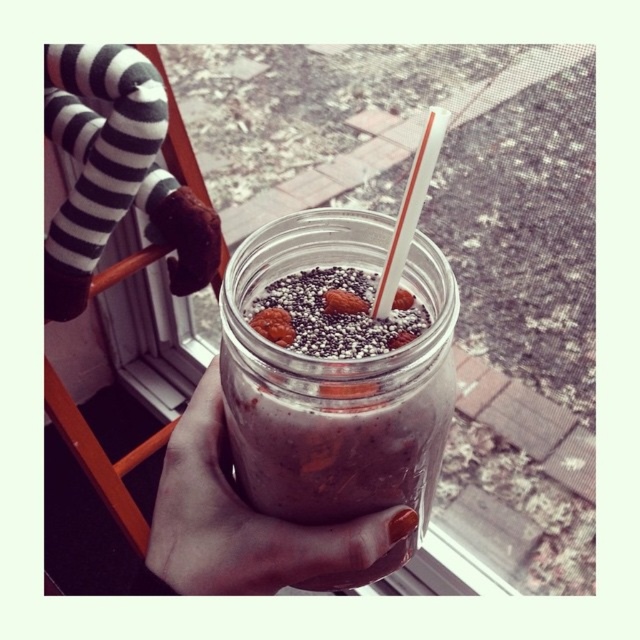
Is translucent glass jar at center to the left of matte glass jar at center from the viewer's perspective?

Incorrect, translucent glass jar at center is not on the left side of matte glass jar at center.

Is translucent glass jar at center taller than matte glass jar at center?

Correct, translucent glass jar at center is much taller as matte glass jar at center.

The width and height of the screenshot is (640, 640). Describe the element at coordinates (337, 374) in the screenshot. I see `translucent glass jar at center` at that location.

Find the location of a particular element. translucent glass jar at center is located at coordinates 337,374.

Is black striped socks at upper left smaller than smooth brown almond at center?

Incorrect, black striped socks at upper left is not smaller in size than smooth brown almond at center.

Looking at this image, does black striped socks at upper left appear over smooth brown almond at center?

Yes.

The width and height of the screenshot is (640, 640). In order to click on black striped socks at upper left in this screenshot , I will do `click(115, 173)`.

Where is `black striped socks at upper left`? The height and width of the screenshot is (640, 640). black striped socks at upper left is located at coordinates (115, 173).

Does matte glass jar at center have a lesser width compared to smoothie at center?

No, matte glass jar at center is not thinner than smoothie at center.

Is matte glass jar at center shorter than smoothie at center?

No, matte glass jar at center is not shorter than smoothie at center.

Who is more distant from viewer, (307, 580) or (288, 332)?

The point (307, 580) is behind.

Find the location of a particular element. Image resolution: width=640 pixels, height=640 pixels. matte glass jar at center is located at coordinates (244, 520).